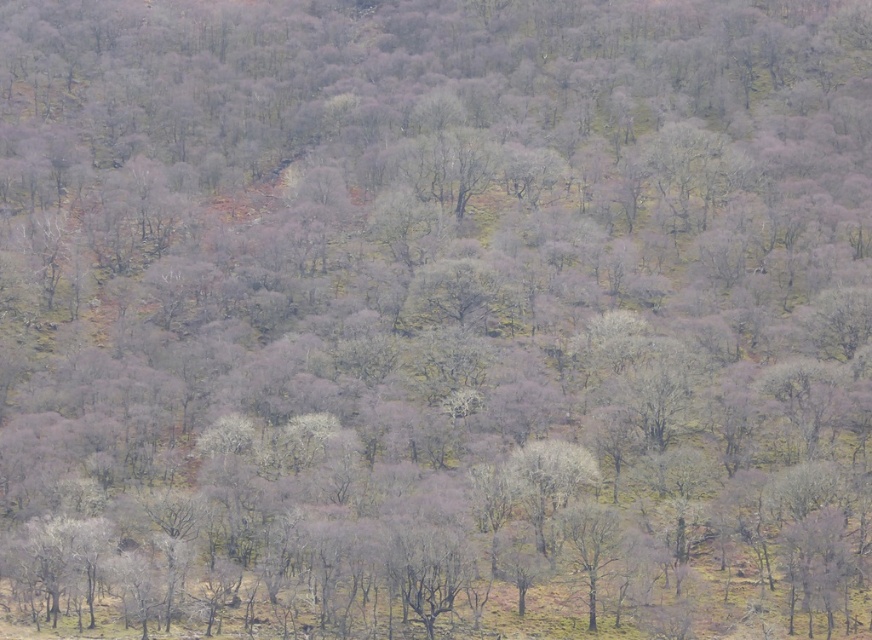
Question: Can you confirm if smooth gray tree at center is bigger than smooth bark tree at center?

Choices:
 (A) no
 (B) yes

Answer: (B)

Question: Which of the following is the closest to the observer?

Choices:
 (A) smooth bark tree at center
 (B) smooth gray tree at center

Answer: (A)

Question: Where is smooth gray tree at center located in relation to smooth bark tree at center in the image?

Choices:
 (A) below
 (B) above

Answer: (B)

Question: Which point appears closest to the camera in this image?

Choices:
 (A) (591, 522)
 (B) (521, 484)

Answer: (A)

Question: Which object appears closest to the camera in this image?

Choices:
 (A) smooth gray tree at center
 (B) smooth bark tree at center

Answer: (B)

Question: Can you confirm if smooth gray tree at center is smaller than smooth bark tree at center?

Choices:
 (A) no
 (B) yes

Answer: (A)